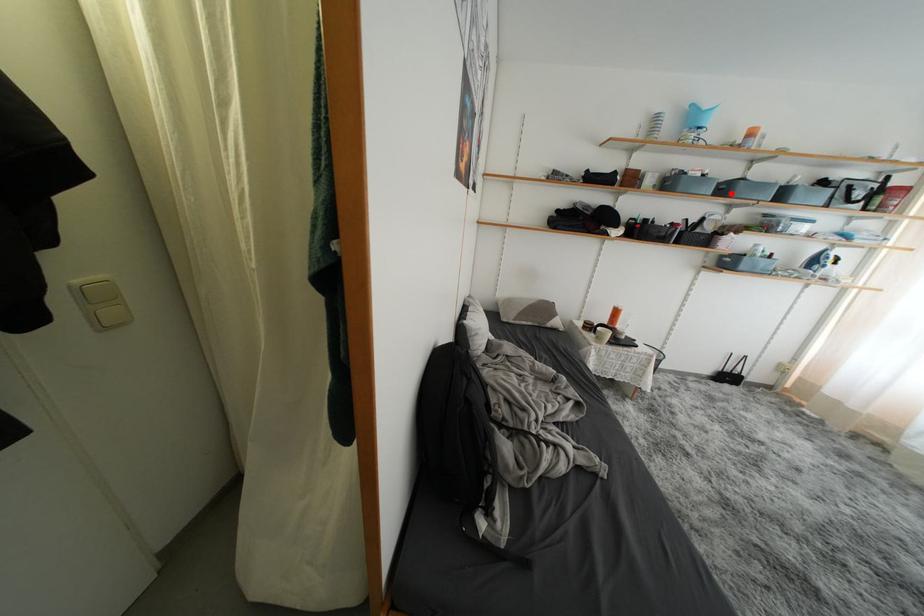
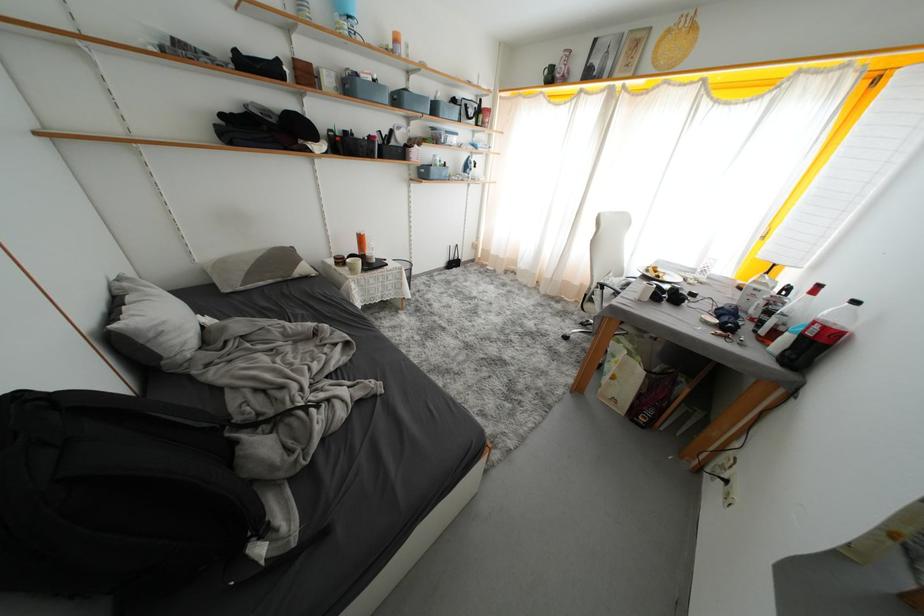
In the second image, find the point that corresponds to the highlighted location in the first image.

(404, 103)